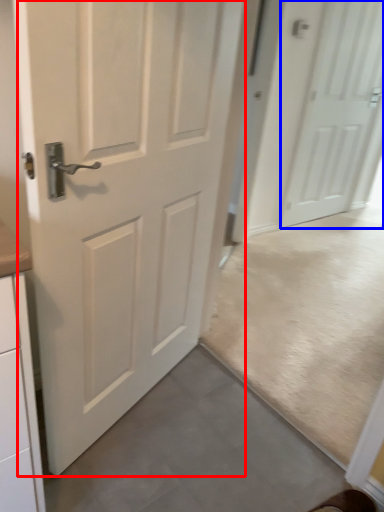
Question: Which object is closer to the camera taking this photo, door (highlighted by a red box) or door (highlighted by a blue box)?

Choices:
 (A) door
 (B) door

Answer: (A)